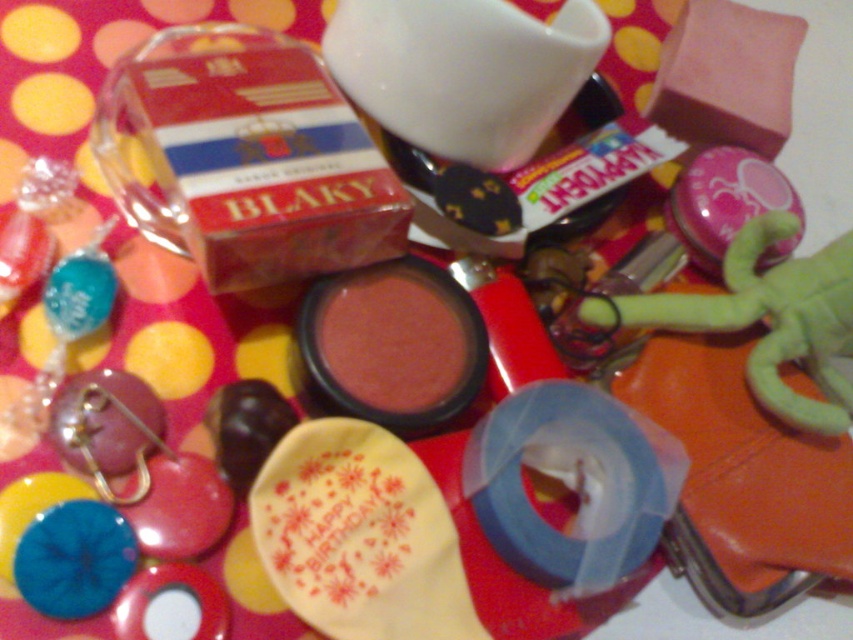
You are organizing the items on the red fabric surface. You need to place a new item between the green plush toy at lower right and the blue rubber band at lower left. Based on their positions, where should you position the new item?

The blue rubber band at lower left is behind the green plush toy at lower right, so to place the new item between them, you should position it in front of the green plush toy at lower right and behind the blue rubber band at lower left.

Based on the provided scene, where is the green plush toy at lower right located in terms of its 2D coordinates?

The green plush toy at lower right is located at the 2D coordinates of point (766, 320).